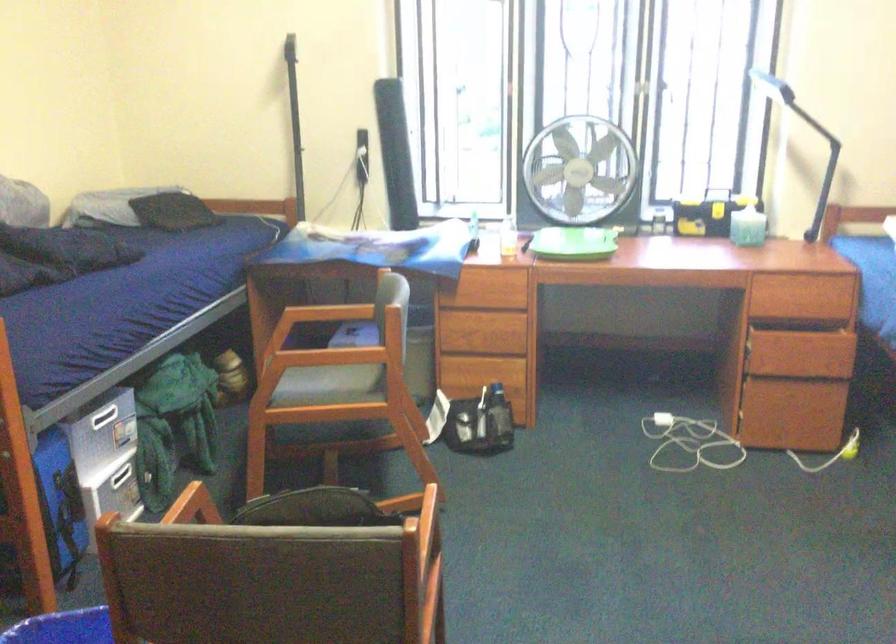
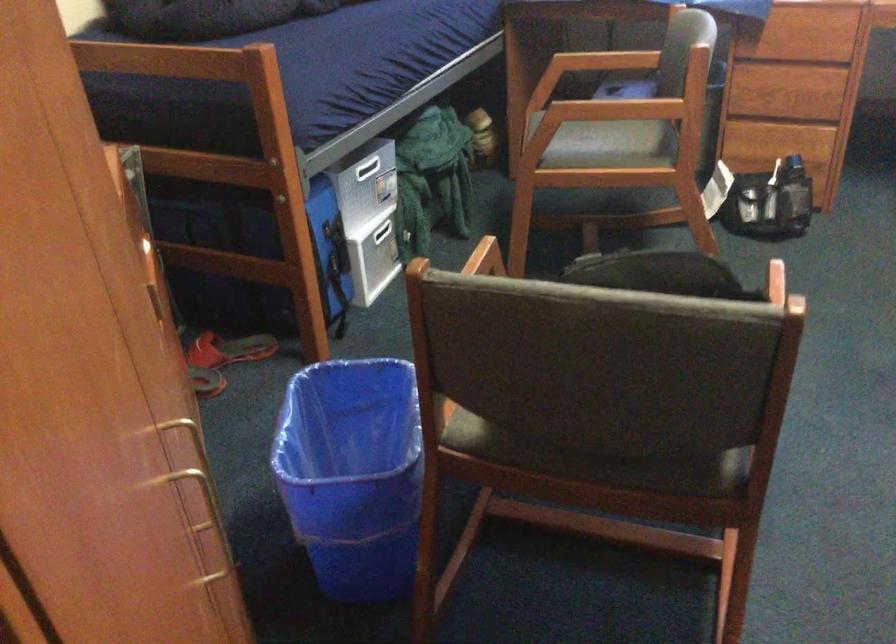
Which direction would the cameraman need to move to produce the second image?

The cameraman walked toward left, forward.